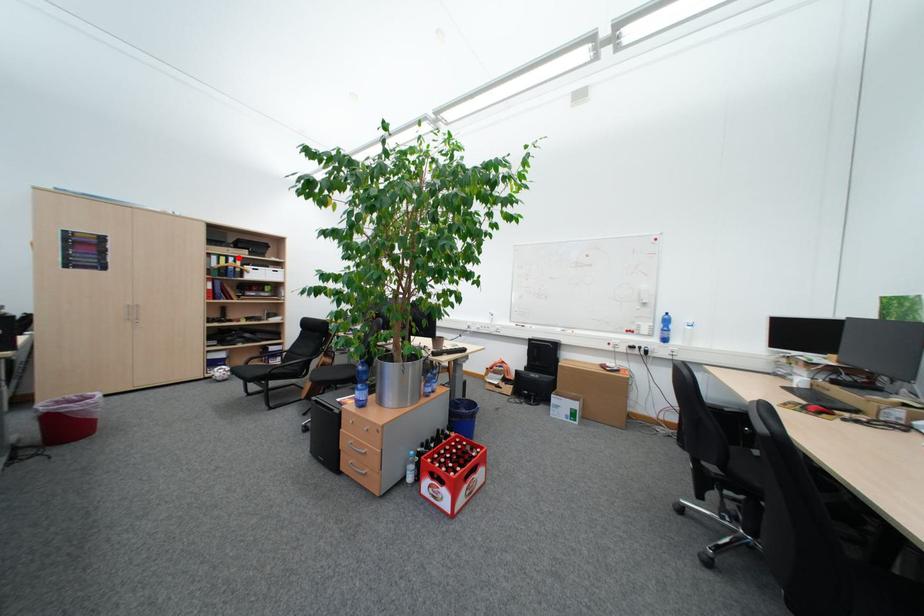
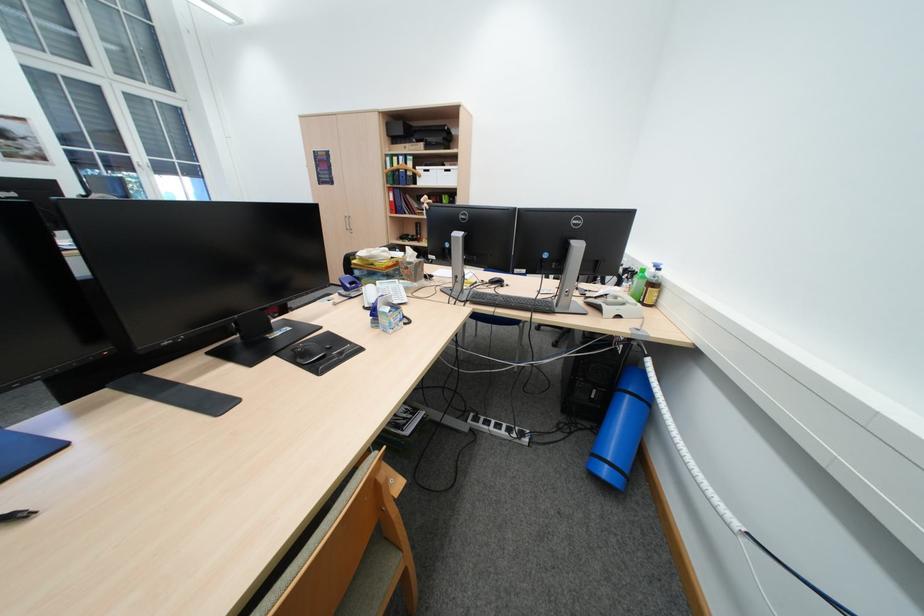
Where in the second image is the point corresponding to the highlighted location from the first image?

(409, 156)